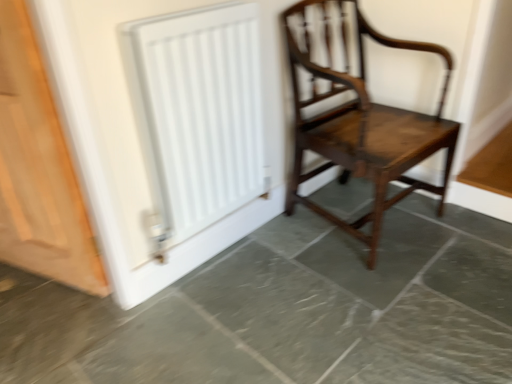
Question: From a real-world perspective, is gray marble floor at center above or below white matte radiator at upper left?

Choices:
 (A) above
 (B) below

Answer: (B)

Question: Based on their sizes in the image, would you say gray marble floor at center is bigger or smaller than white matte radiator at upper left?

Choices:
 (A) small
 (B) big

Answer: (B)

Question: Which object is the farthest from the white matte radiator at upper left?

Choices:
 (A) gray marble floor at center
 (B) mahogany wooden chair at center
 (C) light brown wood door at left

Answer: (A)

Question: Based on their relative distances, which object is farther from the white matte radiator at upper left?

Choices:
 (A) mahogany wooden chair at center
 (B) gray marble floor at center
 (C) light brown wood door at left

Answer: (B)